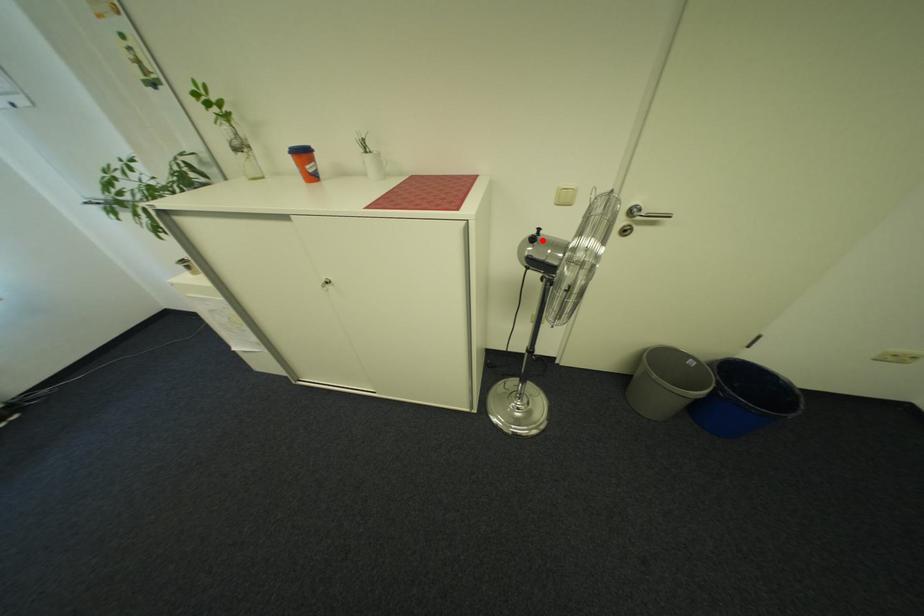
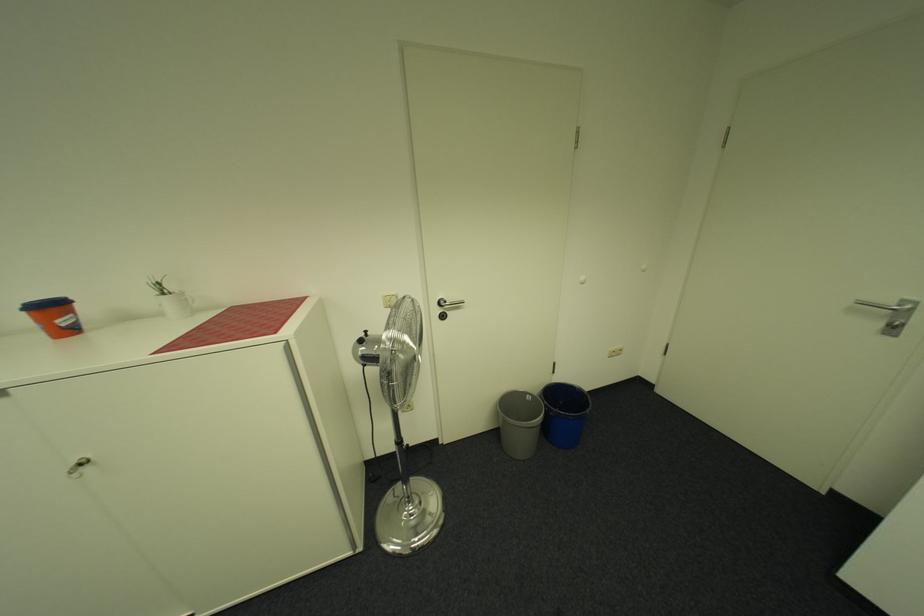
Find the pixel in the second image that matches the highlighted location in the first image.

(371, 342)